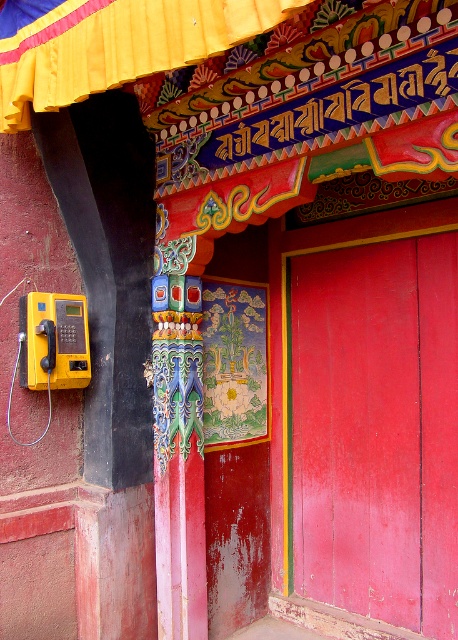
Question: In this image, where is smooth glossy wood door at center located relative to yellow plastic phone at left?

Choices:
 (A) left
 (B) right

Answer: (B)

Question: Can you confirm if painted wood pillar at center is wider than yellow plastic phone at left?

Choices:
 (A) yes
 (B) no

Answer: (B)

Question: Which is nearer to the smooth glossy wood door at center?

Choices:
 (A) yellow plastic phone at left
 (B) painted wood pillar at center

Answer: (B)

Question: Does smooth glossy wood door at center have a greater width compared to painted wood pillar at center?

Choices:
 (A) no
 (B) yes

Answer: (B)

Question: Based on their relative distances, which object is nearer to the painted wood pillar at center?

Choices:
 (A) yellow plastic phone at left
 (B) smooth glossy wood door at center

Answer: (A)

Question: Which of the following is the closest to the observer?

Choices:
 (A) yellow plastic phone at left
 (B) smooth glossy wood door at center
 (C) painted wood pillar at center

Answer: (A)